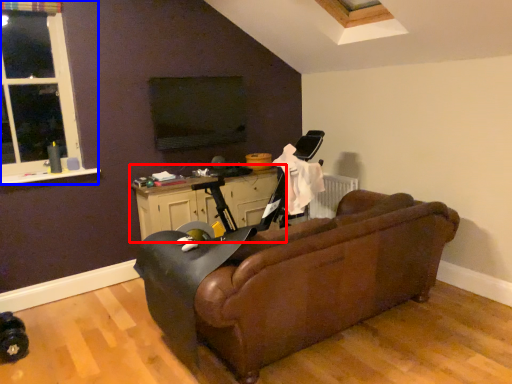
Question: Which point is further to the camera, table (highlighted by a red box) or window (highlighted by a blue box)?

Choices:
 (A) table
 (B) window

Answer: (A)